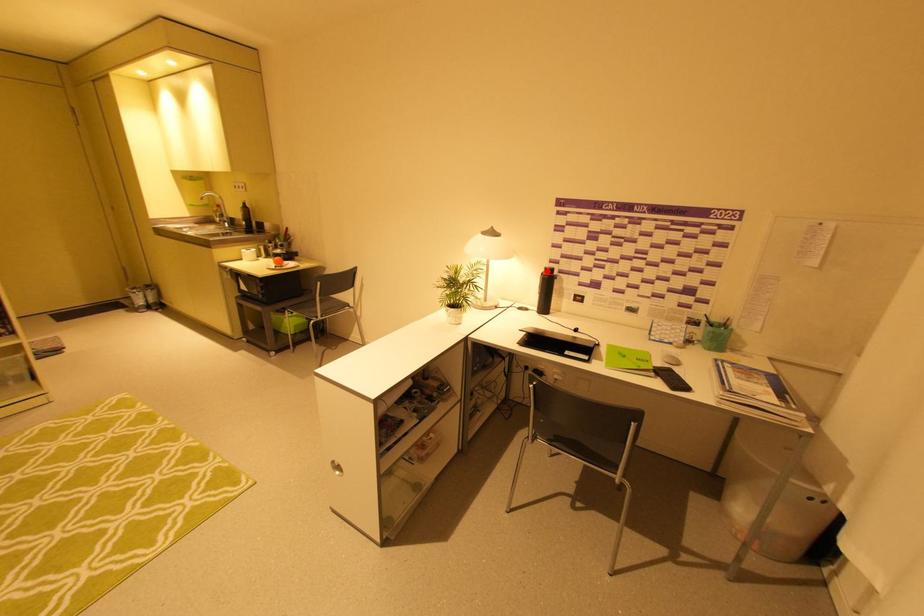
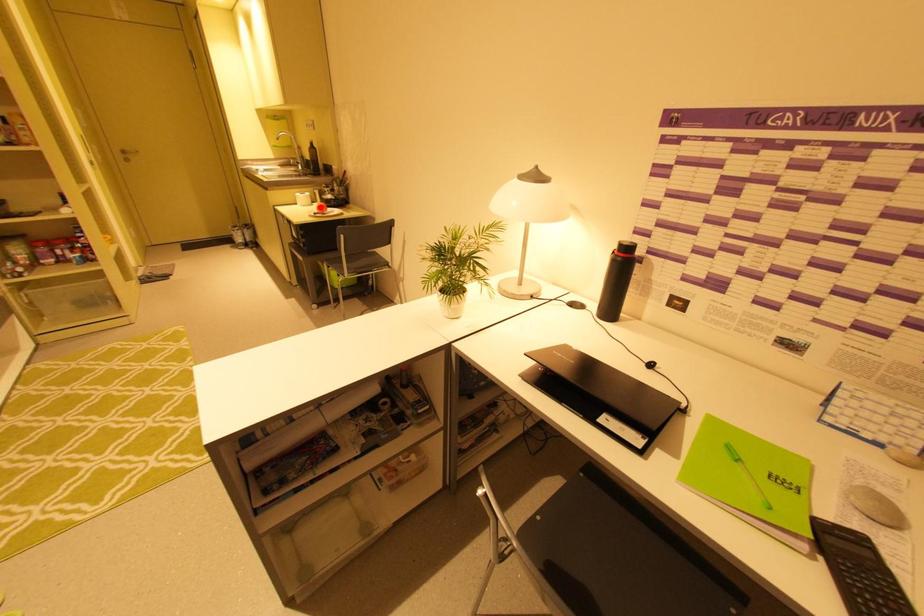
I am providing you with two images of the same scene from different viewpoints. A red point is marked on the first image and another point is marked on the second image. Does the point marked in image1 correspond to the same location as the one in image2?

No